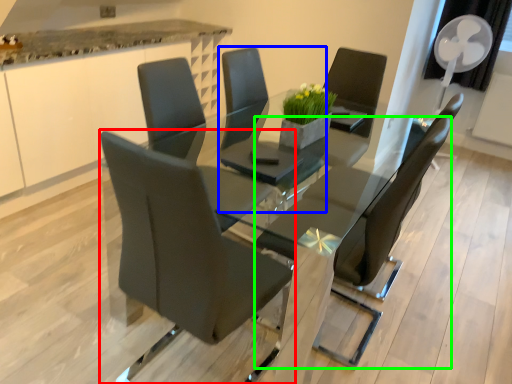
Question: Estimate the real-world distances between objects in this image. Which object is closer to chair (highlighted by a red box), chair (highlighted by a blue box) or chair (highlighted by a green box)?

Choices:
 (A) chair
 (B) chair

Answer: (B)